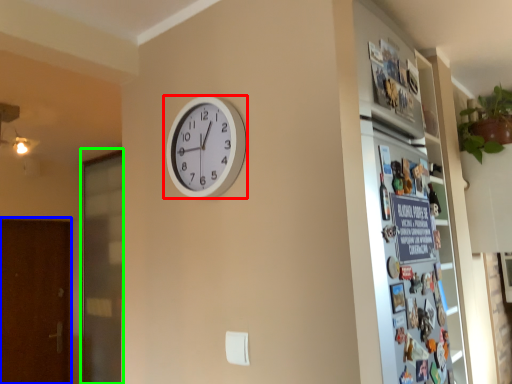
Question: Based on their relative distances, which object is nearer to wall clock (highlighted by a red box)? Choose from screen door (highlighted by a blue box) and screen door (highlighted by a green box).

Choices:
 (A) screen door
 (B) screen door

Answer: (B)